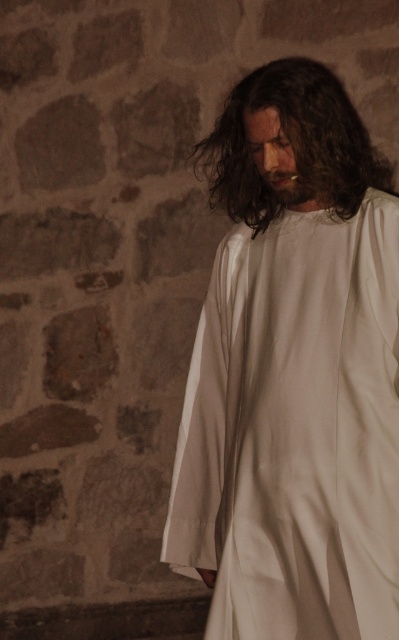
You are an artist sketching this scene. You want to draw the white cloth at center and dark brown silky hair at center first. Which one should you draw first to maintain the correct spatial arrangement?

The dark brown silky hair at center should be drawn first because the white cloth at center is positioned to its right, meaning the hair is on the left side and comes before the cloth in spatial order.

You are an artist sketching this scene and want to ensure proper layering. Since both the white cloth at center and dark brown silky hair at center are at the center, which one should you draw first to maintain the correct spatial relationship?

The white cloth at center is in front of dark brown silky hair at center, so you should draw the dark brown silky hair at center first and then layer the white cloth at center on top to maintain the correct spatial relationship.